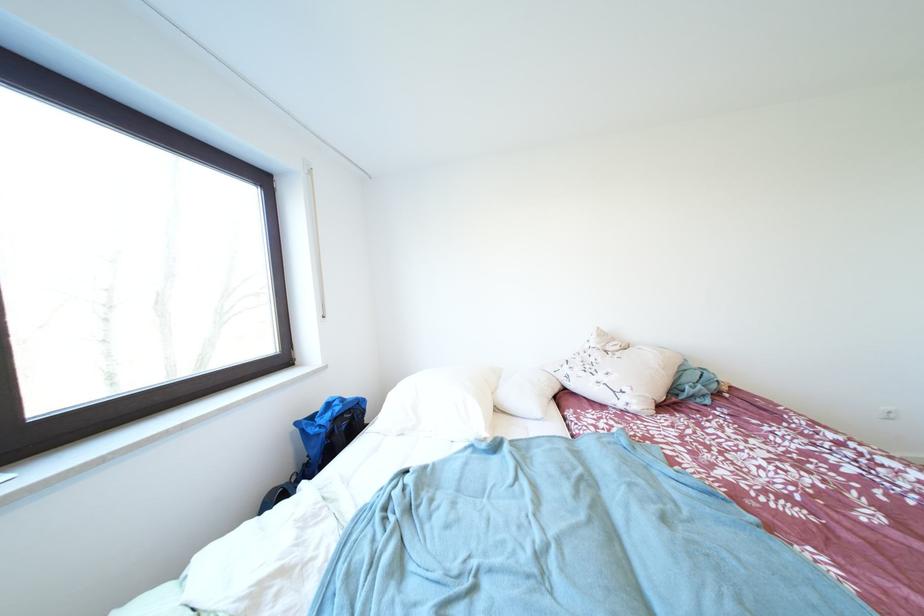
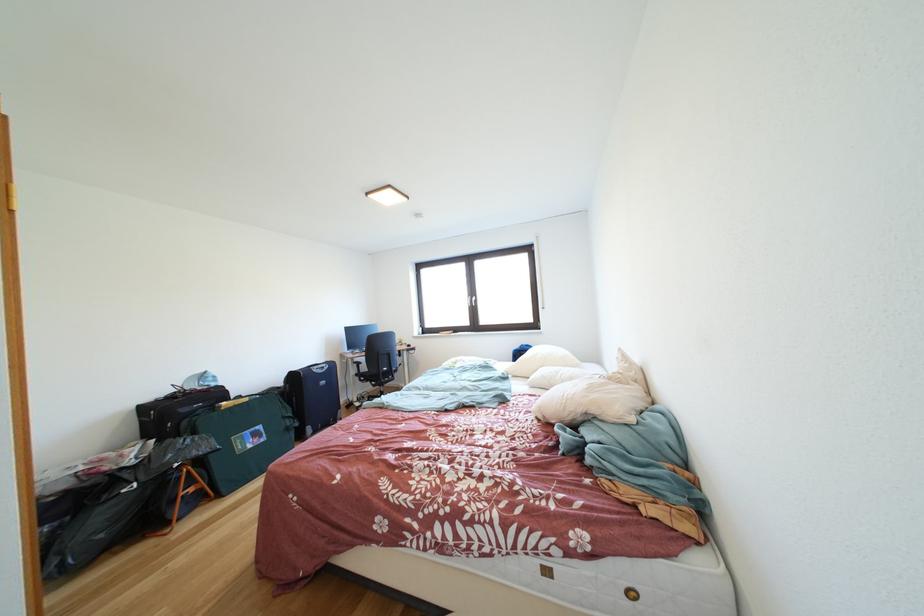
Find the pixel in the second image that matches the point at 350,403 in the first image.

(535, 351)